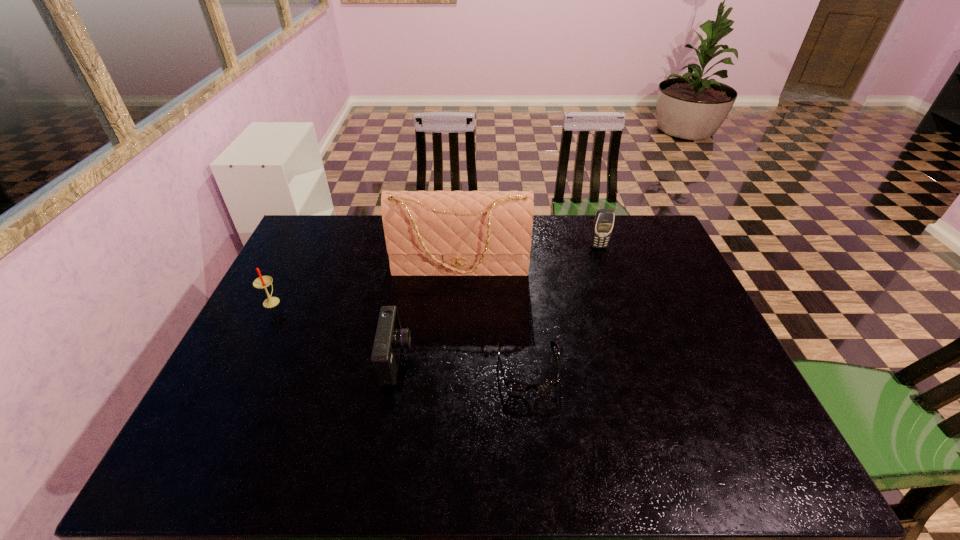
In the image, there is a desktop. Identify the location of blank space at the far left corner. This screenshot has width=960, height=540. (311, 241).

Locate an element on the screen. vacant area at the near left corner is located at coordinates [252, 460].

Locate an element on the screen. Image resolution: width=960 pixels, height=540 pixels. free space at the far right corner is located at coordinates (637, 244).

Locate an element on the screen. free space between the tallest object and the candle is located at coordinates (366, 285).

Locate an element on the screen. free area in between the third nearest object and the camera is located at coordinates (334, 330).

At what (x,y) coordinates should I click in order to perform the action: click on empty space between the shortest object and the rightmost object. Please return your answer as a coordinate pair (x, y). The height and width of the screenshot is (540, 960). Looking at the image, I should click on (564, 307).

The height and width of the screenshot is (540, 960). I want to click on free space between the leftmost object and the second farthest object, so (366, 285).

I want to click on free space between the shortest object and the cellular telephone, so click(564, 307).

Identify which object is the closest to the leftmost object. Please provide its 2D coordinates. Your answer should be formatted as a tuple, i.e. [(x, y)], where the tuple contains the x and y coordinates of a point satisfying the conditions above.

[(428, 233)]

Locate an element on the screen. object that is the second nearest to the shortest object is located at coordinates (428, 233).